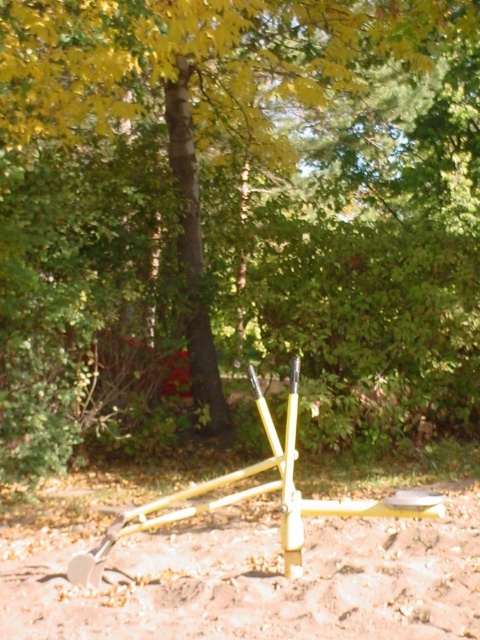
Does green matte tree at center have a greater height compared to yellow matte shovel at center?

Yes.

Can you confirm if green matte tree at center is bigger than yellow matte shovel at center?

Actually, green matte tree at center might be smaller than yellow matte shovel at center.

Between point (332, 352) and point (196, 628), which one is positioned in front?

Point (196, 628) is in front.

Locate an element on the screen. The image size is (480, 640). green matte tree at center is located at coordinates (244, 200).

The image size is (480, 640). What do you see at coordinates (253, 579) in the screenshot?
I see `yellow matte shovel at center` at bounding box center [253, 579].

Is point (409, 600) closer to camera compared to point (294, 566)?

Yes, point (409, 600) is closer to viewer.

Where is `yellow matte shovel at center`? yellow matte shovel at center is located at coordinates (253, 579).

Between green matte tree at center and yellow metallic tool at center, which one has less height?

green matte tree at center is shorter.

Is point (187, 273) behind point (272, 484)?

Yes, point (187, 273) is farther from viewer.

Is point (156, 28) positioned in front of point (207, 502)?

No, it is not.

This screenshot has width=480, height=640. Identify the location of green matte tree at center. (244, 200).